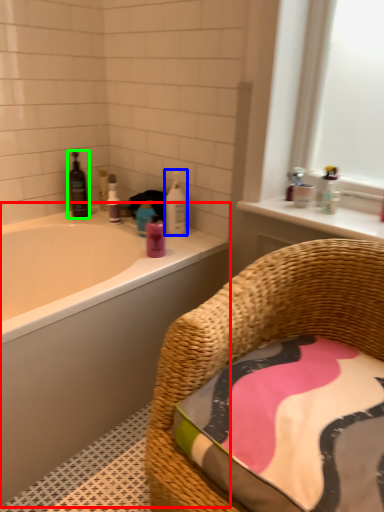
Question: Considering the real-world distances, which object is farthest from bathtub (highlighted by a red box)? cleaning product (highlighted by a blue box) or wine bottle (highlighted by a green box)?

Choices:
 (A) cleaning product
 (B) wine bottle

Answer: (B)